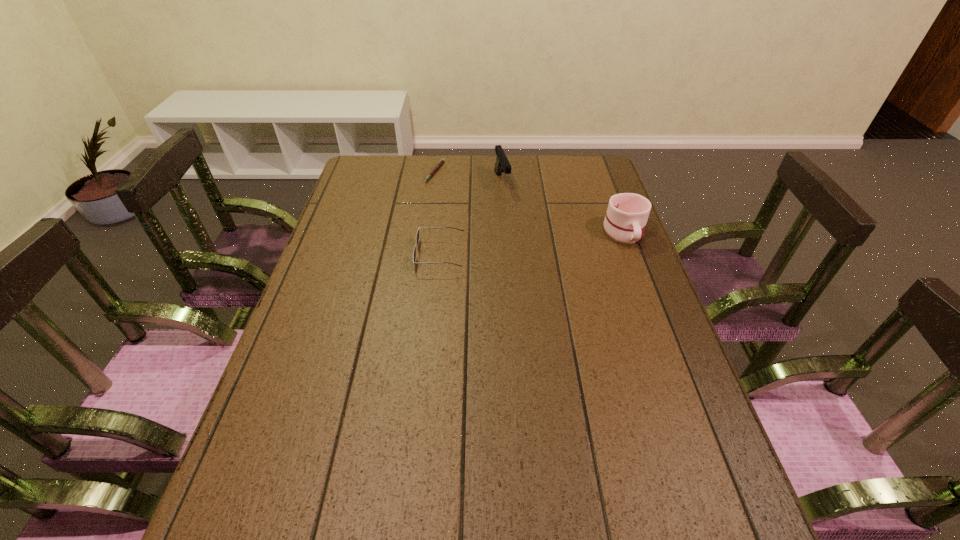
The width and height of the screenshot is (960, 540). In order to click on vacant space on the desktop that is between the sunglasses and the rightmost object and is positioned on the front-facing side of the second object from right to left in this screenshot , I will do `click(530, 244)`.

Find the location of a particular element. free space on the desktop that is between the sunglasses and the mug and is positioned at the nib of the shortest object is located at coordinates (530, 244).